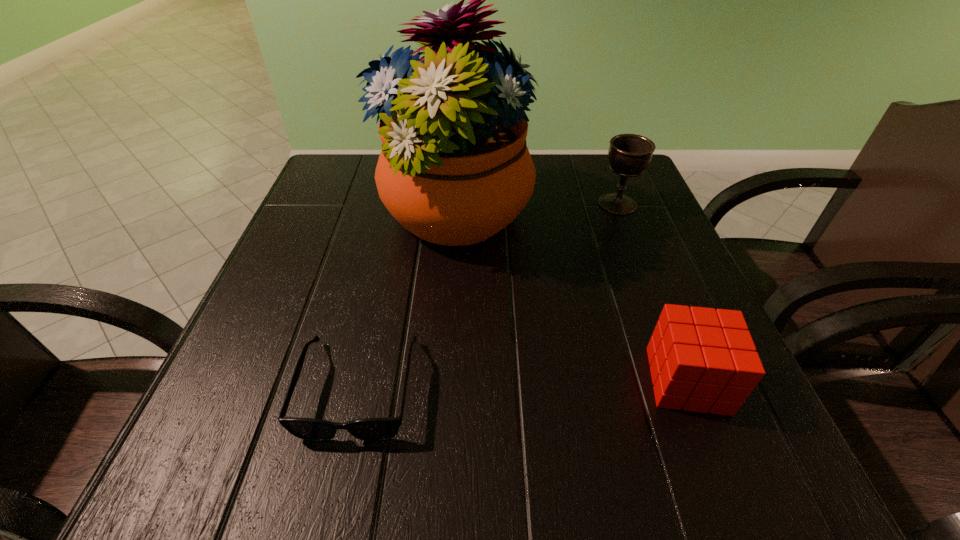
The image size is (960, 540). I want to click on flower arrangement, so click(454, 169).

In order to click on chalice in this screenshot , I will do `click(629, 155)`.

Where is `the second shortest object`? the second shortest object is located at coordinates (704, 360).

This screenshot has height=540, width=960. Identify the location of the shortest object. (384, 428).

Where is `free space located on the back of the tallest object`? Image resolution: width=960 pixels, height=540 pixels. free space located on the back of the tallest object is located at coordinates (459, 154).

You are a GUI agent. You are given a task and a screenshot of the screen. Output one action in this format:
    pyautogui.click(x=<x>, y=<y>)
    Task: Click on the vacant region located 0.180m on the back of the chalice
    
    Given the screenshot: What is the action you would take?
    pyautogui.click(x=598, y=155)

Locate an element on the screen. This screenshot has width=960, height=540. vacant space situated 0.140m on the back of the cube is located at coordinates (651, 287).

Find the location of a particular element. Image resolution: width=960 pixels, height=540 pixels. vacant area situated 0.060m at the front lenses of the shortest object is located at coordinates (336, 488).

You are a GUI agent. You are given a task and a screenshot of the screen. Output one action in this format:
    pyautogui.click(x=<x>, y=<y>)
    Task: Click on the flower arrangement that is at the far edge
    This screenshot has width=960, height=540.
    Given the screenshot: What is the action you would take?
    pyautogui.click(x=454, y=169)

Where is `chalice located at the far edge`? chalice located at the far edge is located at coordinates (629, 155).